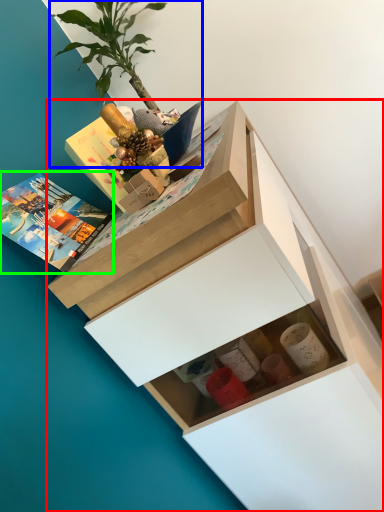
Question: Considering the real-world distances, which object is closest to chest of drawers (highlighted by a red box)? houseplant (highlighted by a blue box) or book (highlighted by a green box).

Choices:
 (A) houseplant
 (B) book

Answer: (B)